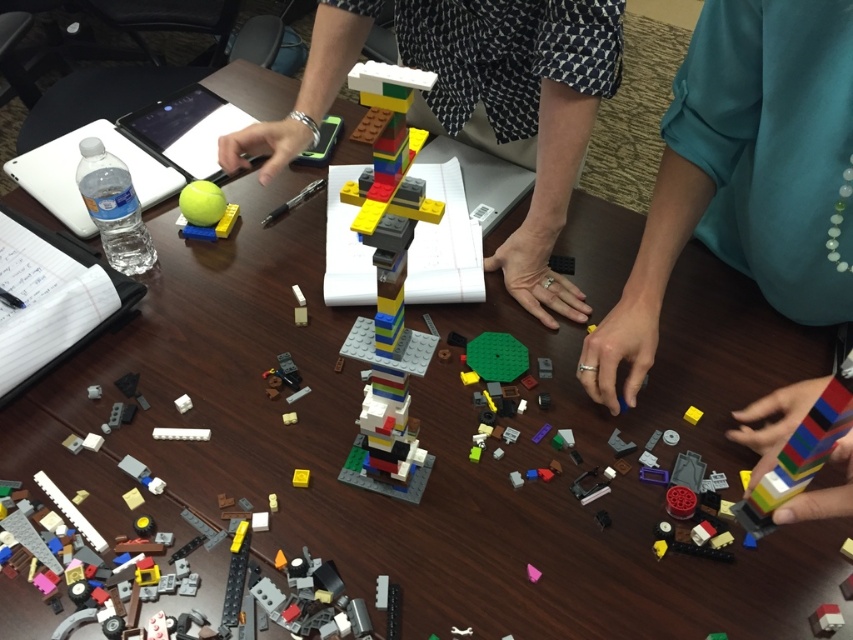
Looking at this image, you are organizing a LEGO competition and need to ensure that the multicolored plastic lego tower at center and the multicolored plastic tower at center are displayed on a shelf. The shelf has a height limit of 30 cm. Can both towers be displayed without exceeding the height limit?

The multicolored plastic lego tower at center is taller than the multicolored plastic tower at center. However, since the height limit is 30 cm, both towers can be displayed on the shelf only if the taller tower does not exceed 30 cm. The exact heights are not provided, so it is uncertain whether they meet the requirement.

What are the coordinates of the multicolored plastic lego tower at center?

The coordinates of the multicolored plastic lego tower at center are at point (519, 108).

You are organizing a LEGO building competition and need to ensure that all participants can see the central LEGO tower. Given that the teal fabric hand at center right is blocking the view of the multicolored plastic lego tower at center, will the hand be an obstruction for viewers on the right side of the table?

The teal fabric hand at center right has a smaller size compared to the multicolored plastic lego tower at center, so it may still block the view partially depending on the angle, but since it is smaller, viewers might see parts of the tower around it.